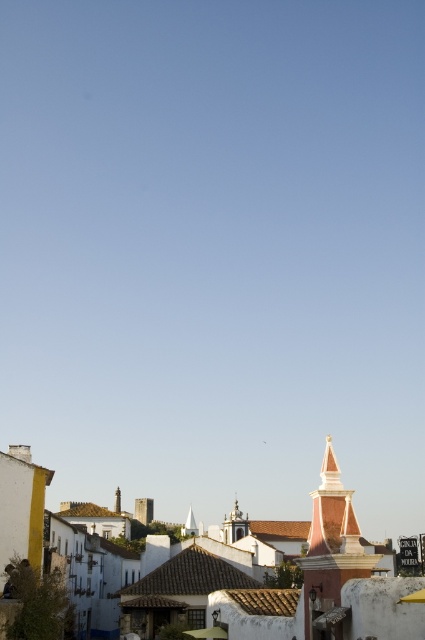
Question: Which point is farther to the camera?

Choices:
 (A) (329, 564)
 (B) (113, 508)
 (C) (192, 515)
 (D) (261, 604)

Answer: (C)

Question: Observing the image, what is the correct spatial positioning of smooth pink tower at center in reference to white stucco spire at center?

Choices:
 (A) above
 (B) below

Answer: (A)

Question: Which point is farther to the camera?

Choices:
 (A) (326, 625)
 (B) (187, 532)

Answer: (B)

Question: Which object is the closest to the white stucco spire at center?

Choices:
 (A) white textured building at lower center
 (B) smooth pink tower at center
 (C) silver metallic tower at center

Answer: (C)

Question: Is white stucco spire at center smaller than pink stucco spire at center?

Choices:
 (A) yes
 (B) no

Answer: (B)

Question: Can you confirm if silver metallic tower at center is positioned above pink stucco spire at center?

Choices:
 (A) yes
 (B) no

Answer: (A)